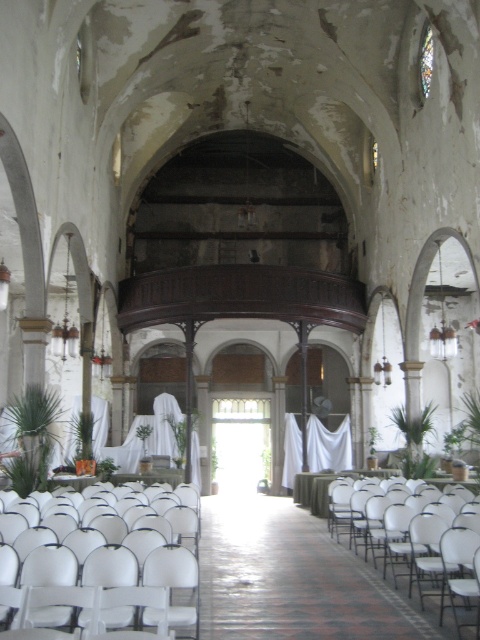
Which is behind, point (156, 529) or point (375, 577)?

The point (375, 577) is behind.

Between white plastic chairs at lower center and white plastic chair at center, which one is positioned higher?

Positioned higher is white plastic chairs at lower center.

Between point (67, 568) and point (434, 556), which one is positioned behind?

Point (434, 556)

At what (x,y) coordinates should I click in order to perform the action: click on white plastic chairs at lower center. Please return your answer as a coordinate pair (x, y). The width and height of the screenshot is (480, 640). Looking at the image, I should click on (107, 586).